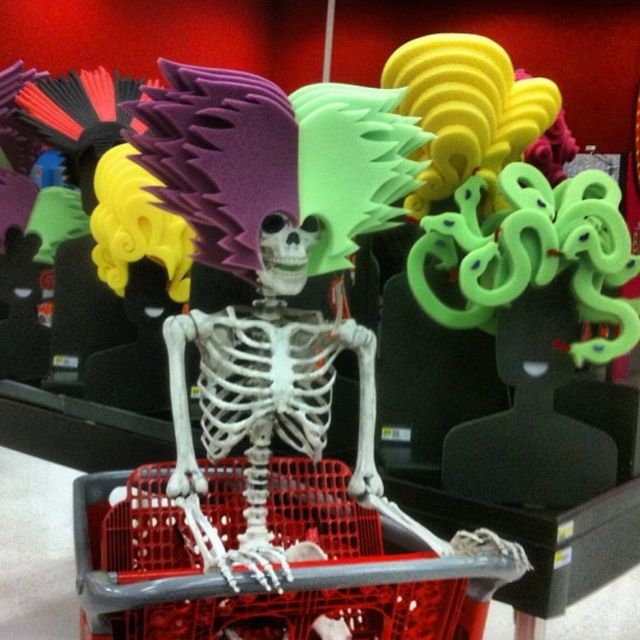
You are a customer in a store and see the red plastic shopping basket at center and the green rubber snake at upper right. Which object is closer to you?

The red plastic shopping basket at center is closer to you because it is in front of the green rubber snake at upper right.